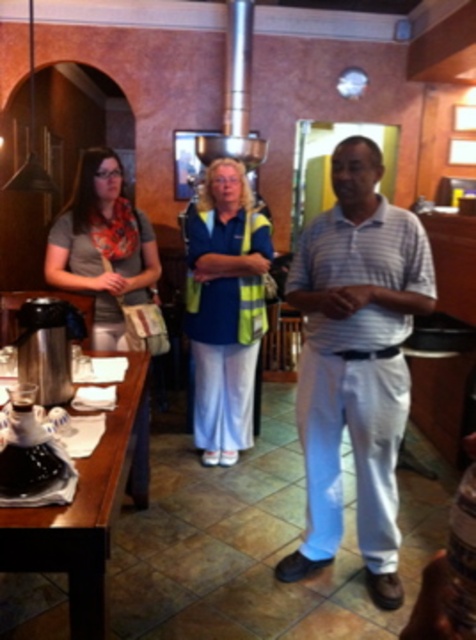
You are a photographer setting up for a group photo. You want to ensure that the white striped polo shirt at center and the matte gray scarf at left are both clearly visible in the frame. Based on their positions, which one might require you to adjust your camera angle to include it properly?

The matte gray scarf at left is farther from the viewer than the white striped polo shirt at center, so you might need to adjust the camera angle to ensure the matte gray scarf at left is fully visible in the frame.

Based on the photo, you are trying to decide which item to reach for first from your standing position. Both the white striped polo shirt at center and the blue reflective vest at center are hanging on a rack. Which one should you grab first based on their height?

The white striped polo shirt at center is much taller than the blue reflective vest at center, so you should grab the white striped polo shirt at center first since it is higher up and easier to reach.